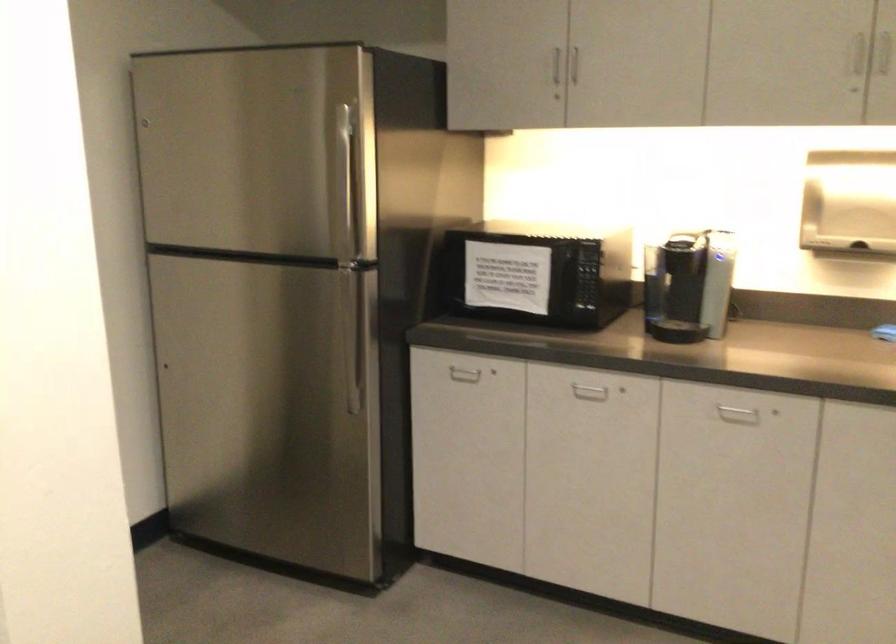
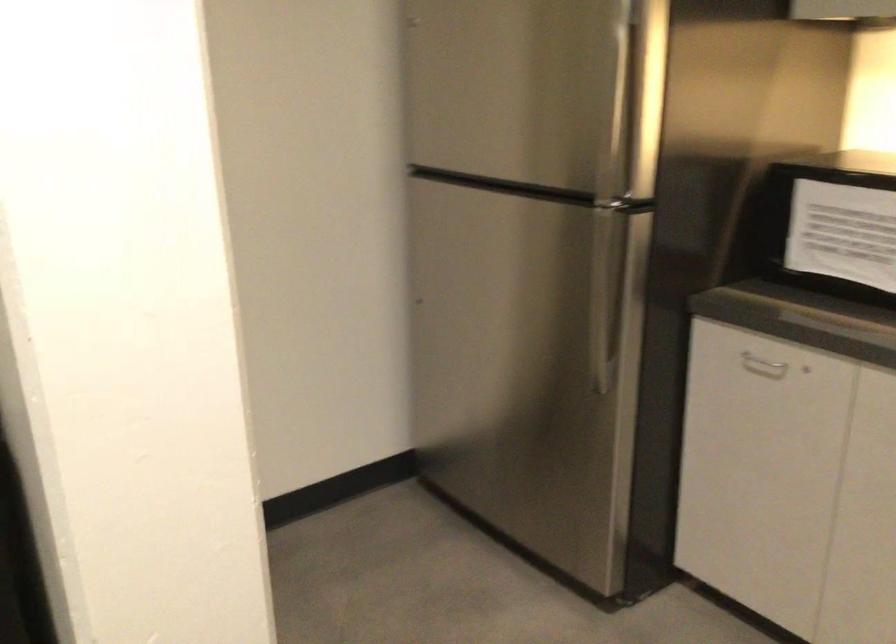
Question: The first image is from the beginning of the video and the second image is from the end. How did the camera likely rotate when shooting the video?

Choices:
 (A) Left
 (B) Right
 (C) Up
 (D) Down

Answer: (A)